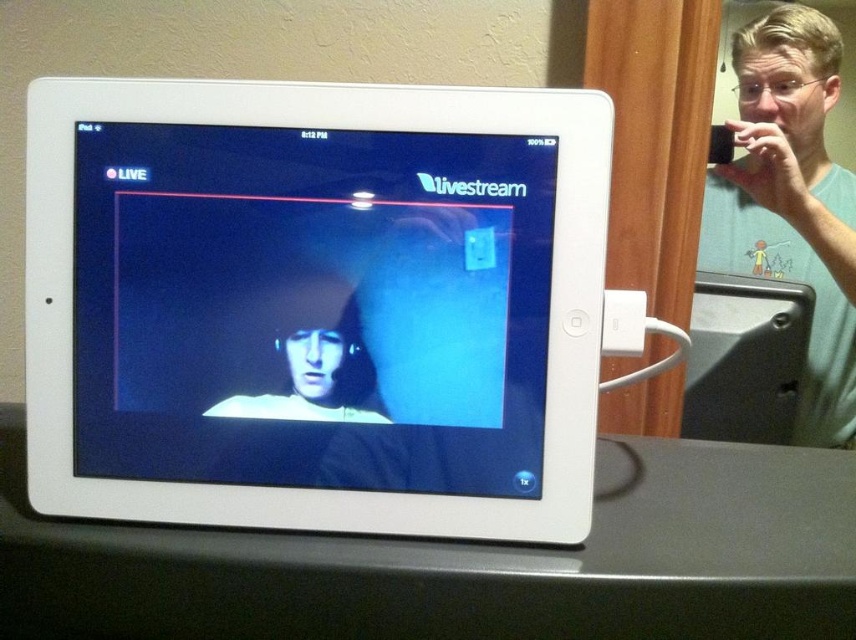
Is matte black screen at center positioned before green matte phone at upper right?

Yes, it is.

Image resolution: width=856 pixels, height=640 pixels. In order to click on matte black screen at center in this screenshot , I will do `click(311, 307)`.

Based on the photo, can you confirm if green matte phone at upper right is shorter than matte black hoodie at center?

No.

Is green matte phone at upper right taller than matte black hoodie at center?

Yes, green matte phone at upper right is taller than matte black hoodie at center.

The width and height of the screenshot is (856, 640). I want to click on green matte phone at upper right, so click(x=791, y=202).

Image resolution: width=856 pixels, height=640 pixels. In order to click on green matte phone at upper right in this screenshot , I will do `click(791, 202)`.

Which is below, matte black screen at center or matte black hoodie at center?

matte black hoodie at center is lower down.

Is matte black screen at center positioned in front of matte black hoodie at center?

Yes, it is in front of matte black hoodie at center.

Locate an element on the screen. This screenshot has width=856, height=640. matte black screen at center is located at coordinates (311, 307).